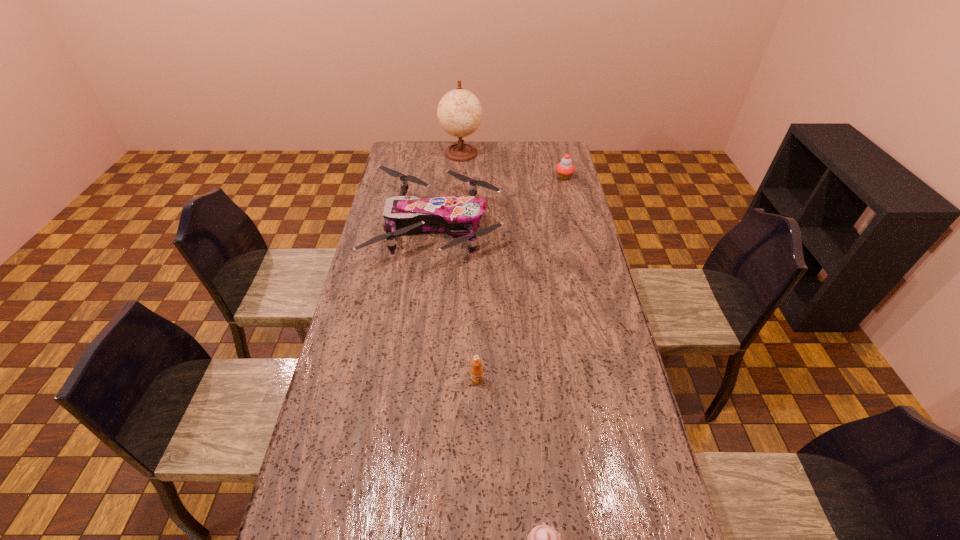
This screenshot has width=960, height=540. Identify the location of free spot between the drone and the orange juice. (457, 303).

Image resolution: width=960 pixels, height=540 pixels. What are the coordinates of `unoccupied area between the drone and the right cupcake` in the screenshot? It's located at (500, 202).

I want to click on vacant point located between the drone and the fourth farthest object, so click(457, 303).

The width and height of the screenshot is (960, 540). I want to click on object that is the fourth closest one to the third nearest object, so click(542, 539).

I want to click on object that is the fourth nearest to the second farthest object, so click(542, 539).

Identify the location of vacant space that satisfies the following two spatial constraints: 1. on the surface of the tallest object; 2. on the front-facing side of the third farthest object. (457, 227).

This screenshot has height=540, width=960. I want to click on free space that satisfies the following two spatial constraints: 1. on the surface of the tallest object; 2. on the front-facing side of the drone, so click(x=457, y=227).